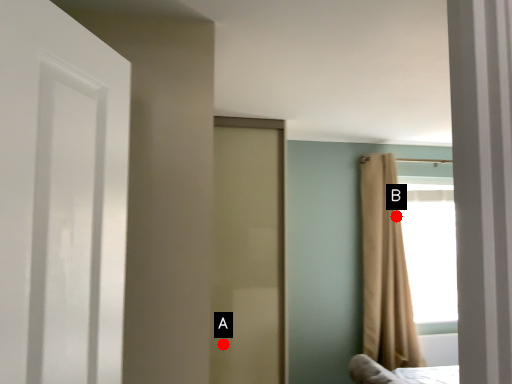
Question: Two points are circled on the image, labeled by A and B beside each circle. Which point appears closest to the camera in this image?

Choices:
 (A) A is closer
 (B) B is closer

Answer: (A)